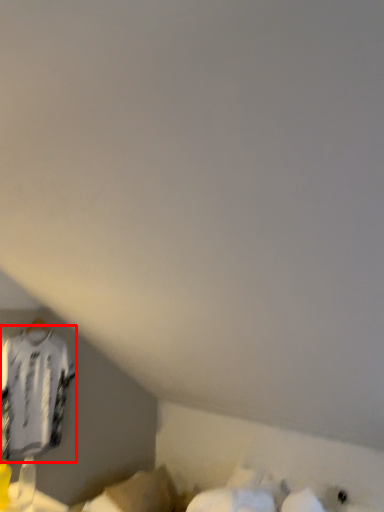
Question: From the image's perspective, considering the relative positions of clothing (annotated by the red box) and wide in the image provided, where is clothing (annotated by the red box) located with respect to the staircase?

Choices:
 (A) below
 (B) above

Answer: (B)